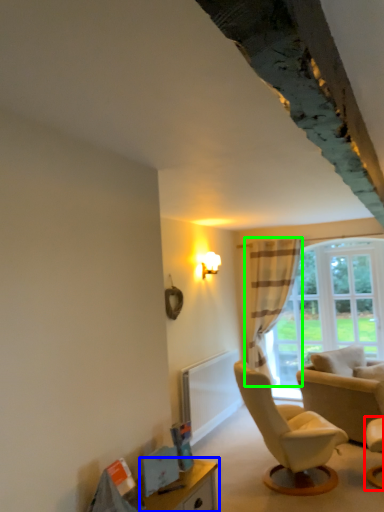
Question: Based on their relative distances, which object is farther from chair (highlighted by a red box)? Choose from table (highlighted by a blue box) and curtain (highlighted by a green box).

Choices:
 (A) table
 (B) curtain

Answer: (B)